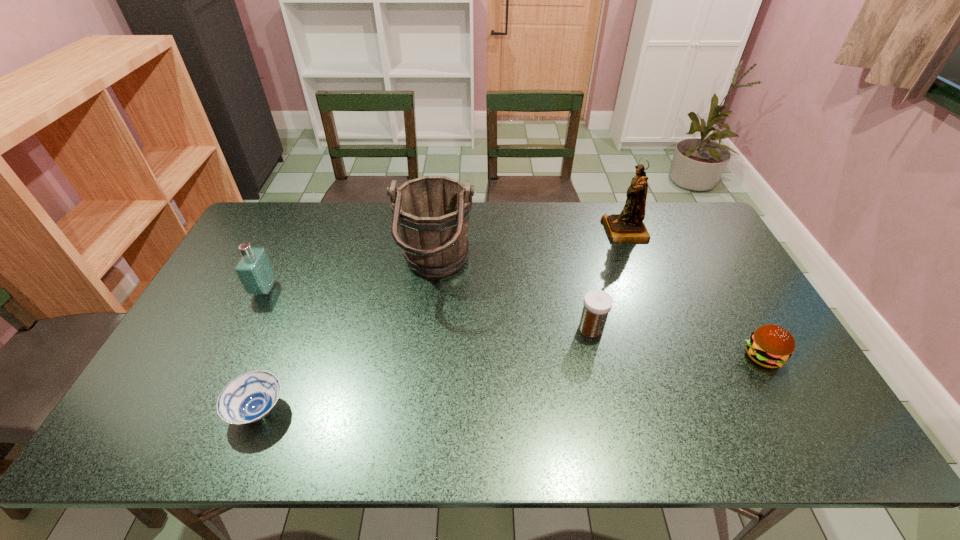
Where is `object present at the near edge`? object present at the near edge is located at coordinates (250, 397).

At what (x,y) coordinates should I click in order to perform the action: click on object located in the left edge section of the desktop. Please return your answer as a coordinate pair (x, y). This screenshot has width=960, height=540. Looking at the image, I should click on (254, 269).

Find the location of a particular element. This screenshot has width=960, height=540. object that is positioned at the right edge is located at coordinates (770, 346).

Image resolution: width=960 pixels, height=540 pixels. In the image, there is a desktop. Identify the location of free space at the far edge. (547, 206).

In the image, there is a desktop. At what (x,y) coordinates should I click in order to perform the action: click on vacant space at the near edge. Please return your answer as a coordinate pair (x, y). Looking at the image, I should click on (541, 431).

In the image, there is a desktop. Identify the location of free space at the left edge. This screenshot has width=960, height=540. (215, 354).

You are a GUI agent. You are given a task and a screenshot of the screen. Output one action in this format:
    pyautogui.click(x=<x>, y=<y>)
    Task: Click on the vacant space at the right edge
    
    Given the screenshot: What is the action you would take?
    pyautogui.click(x=759, y=386)

The image size is (960, 540). In order to click on vacant space at the far left corner of the desktop in this screenshot , I will do `click(278, 207)`.

Where is `blank space at the far right corner of the desktop`? Image resolution: width=960 pixels, height=540 pixels. blank space at the far right corner of the desktop is located at coordinates (677, 240).

Locate an element on the screen. This screenshot has width=960, height=540. vacant area that lies between the third object from left to right and the figurine is located at coordinates (530, 250).